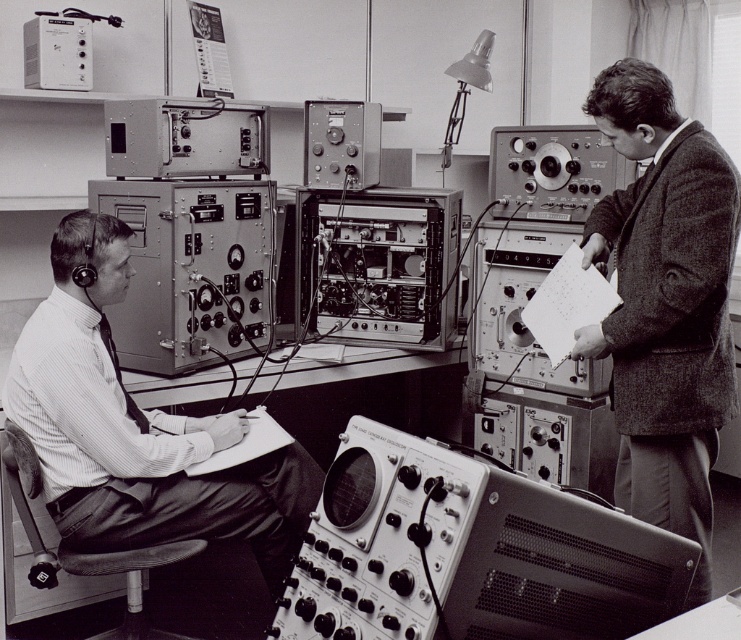
Question: Among these objects, which one is nearest to the camera?

Choices:
 (A) matte black shirt at left
 (B) textured wool blazer at center right

Answer: (B)

Question: Can you confirm if metallic silver oscilloscope at center is positioned above textured wool blazer at center right?

Choices:
 (A) no
 (B) yes

Answer: (A)

Question: Which point is farther to the camera?

Choices:
 (A) textured wool blazer at center right
 (B) matte black shirt at left

Answer: (B)

Question: Does metallic silver oscilloscope at center have a lesser width compared to textured wool blazer at center right?

Choices:
 (A) no
 (B) yes

Answer: (A)

Question: Which point is closer to the camera?

Choices:
 (A) matte black shirt at left
 (B) textured wool blazer at center right
 (C) metallic silver oscilloscope at center

Answer: (C)

Question: Does metallic silver oscilloscope at center have a greater width compared to textured wool blazer at center right?

Choices:
 (A) no
 (B) yes

Answer: (B)